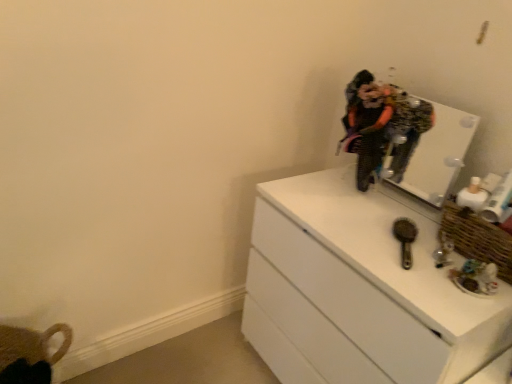
Identify the location of empty space that is ontop of white glossy mirror at upper right (from a real-world perspective). The width and height of the screenshot is (512, 384). (453, 104).